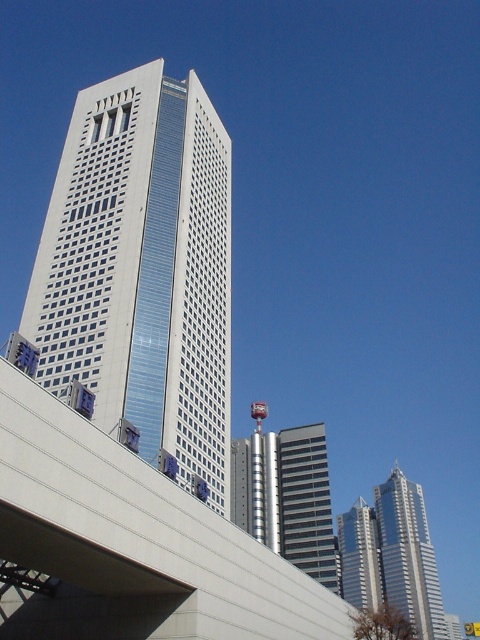
You are standing at the base of the skyscraper and see two points marked on the facade. The first point is at coordinates point (64, 556) and the second is at point (382, 579). Which point is closer to your current position?

Point (64, 556) is in front of point (382, 579), so it is closer to your current position at the base of the skyscraper.

You are a city planner analyzing the urban layout. From your vantage point, which skyscraper would appear closer to you, the white glass skyscraper at center or the shiny silver skyscraper at right?

The white glass skyscraper at center is positioned over the shiny silver skyscraper at right, so it would appear closer to you.

You are a city planner reviewing the urban layout. You need to determine which building occupies more space in the city skyline. Based on the image, which of the two buildings, the dark gray glass building at center or the silver metallic skyscraper at center, is larger in size?

The dark gray glass building at center has a larger size compared to the silver metallic skyscraper at center, so it occupies more space in the city skyline.